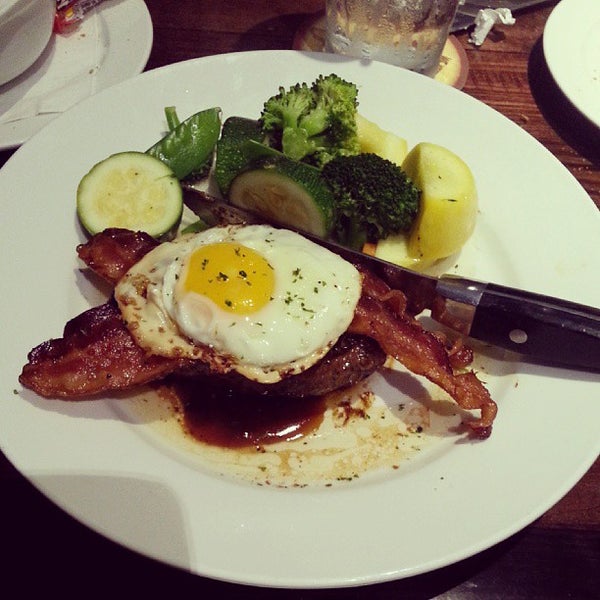
Locate an element on the screen. This screenshot has height=600, width=600. glass is located at coordinates (420, 39).